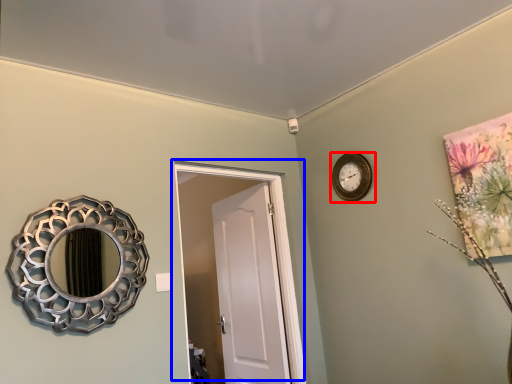
Question: Which object is further to the camera taking this photo, wall clock (highlighted by a red box) or door (highlighted by a blue box)?

Choices:
 (A) wall clock
 (B) door

Answer: (A)